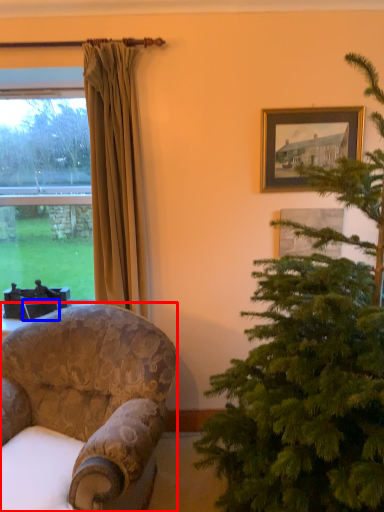
Question: Among these objects, which one is nearest to the camera, chair (highlighted by a red box) or picture frame (highlighted by a blue box)?

Choices:
 (A) chair
 (B) picture frame

Answer: (A)